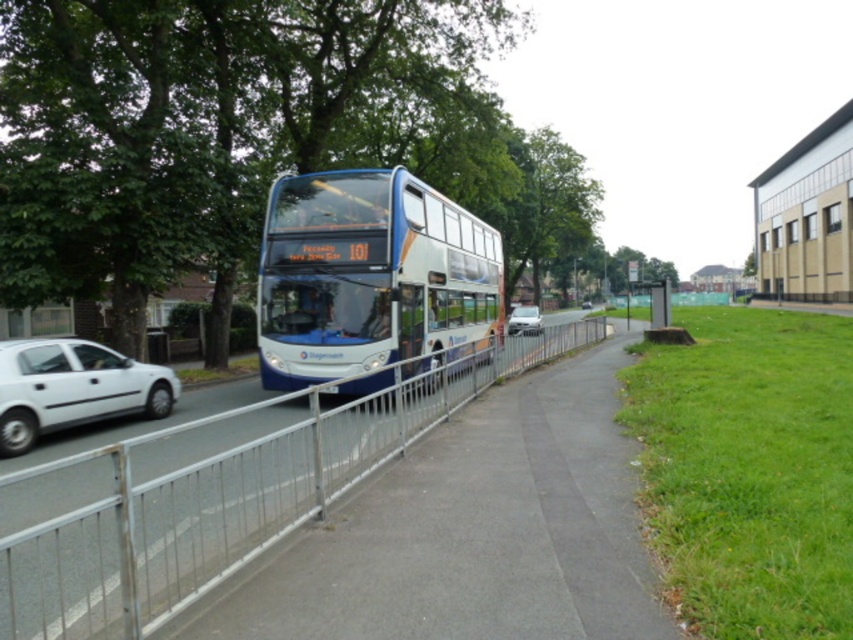
You are a pedestrian standing on the sidewalk next to the blue metallic bus at center and the white matte car at left. Which vehicle takes up more space on the road?

The blue metallic bus at center takes up more space on the road because it is bigger than the white matte car at left.

Based on the photo, you are a pedestrian standing on the sidewalk next to the metallic silver bus stop at right. You want to cross the road to reach the white matte car at center. Is the car currently on the same side of the road as the bus stop?

The metallic silver bus stop at right is positioned over the white matte car at center, meaning the car is directly under the bus stop. Since the bus stop is on the sidewalk side of the road, the white matte car at center is driving on the same side of the road as the bus stop. Therefore, the car is on the same side of the road as the bus stop.

You are a pedestrian on the sidewalk next to the road. You see both the white matte car at left and the white matte car at center driving on the road. Which car appears larger to you?

The white matte car at center appears larger because it is closer to you than the white matte car at left, which is further away.